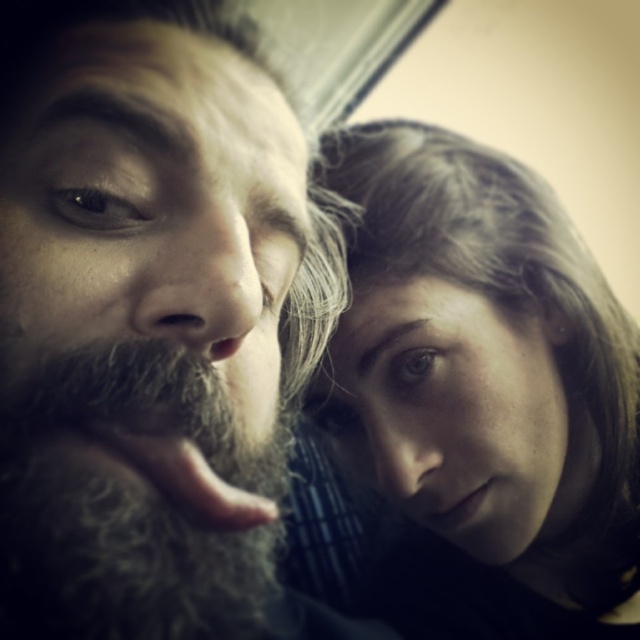
Based on the photo, is dark brown beard at left to the right of smooth skin face at center from the viewer's perspective?

Incorrect, dark brown beard at left is not on the right side of smooth skin face at center.

Who is higher up, dark brown beard at left or smooth skin face at center?

dark brown beard at left

Is point (211, 294) less distant than point (536, 362)?

Yes, point (211, 294) is in front of point (536, 362).

Where is `dark brown beard at left`? dark brown beard at left is located at coordinates (141, 332).

Is gray fuzzy beard at left smaller than smooth skin face at center?

Indeed, gray fuzzy beard at left has a smaller size compared to smooth skin face at center.

Can you confirm if gray fuzzy beard at left is wider than smooth skin face at center?

In fact, gray fuzzy beard at left might be narrower than smooth skin face at center.

Describe the element at coordinates (125, 506) in the screenshot. This screenshot has height=640, width=640. I see `gray fuzzy beard at left` at that location.

Image resolution: width=640 pixels, height=640 pixels. What are the coordinates of `gray fuzzy beard at left` in the screenshot? It's located at (125, 506).

Who is more distant from viewer, [29,108] or [244,595]?

Point [244,595]

Is dark brown beard at left positioned in front of gray fuzzy beard at left?

Yes, it is in front of gray fuzzy beard at left.

The image size is (640, 640). What do you see at coordinates (141, 332) in the screenshot?
I see `dark brown beard at left` at bounding box center [141, 332].

Image resolution: width=640 pixels, height=640 pixels. I want to click on dark brown beard at left, so click(141, 332).